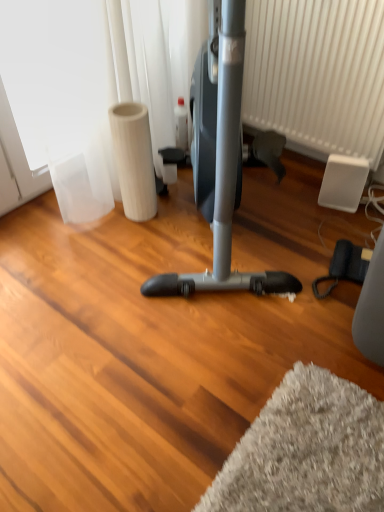
What do you see at coordinates (317, 74) in the screenshot? The width and height of the screenshot is (384, 512). I see `white textured radiator at center` at bounding box center [317, 74].

Find the location of `white textured radiator at center`. white textured radiator at center is located at coordinates (317, 74).

Locate an element on the screen. The width and height of the screenshot is (384, 512). white textured radiator at center is located at coordinates (317, 74).